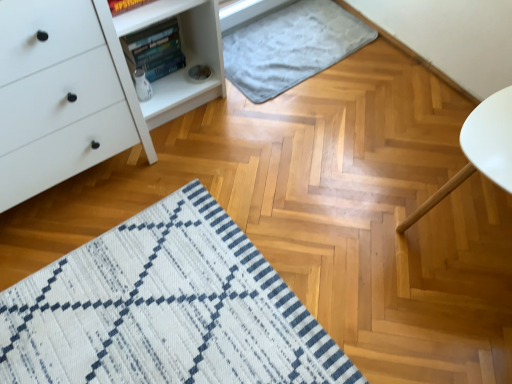
You are a GUI agent. You are given a task and a screenshot of the screen. Output one action in this format:
    pyautogui.click(x=<x>, y=<y>)
    Task: Click on the free space in front of white matte chest of drawers at left
    The image size is (512, 384).
    Given the screenshot: What is the action you would take?
    pyautogui.click(x=80, y=280)